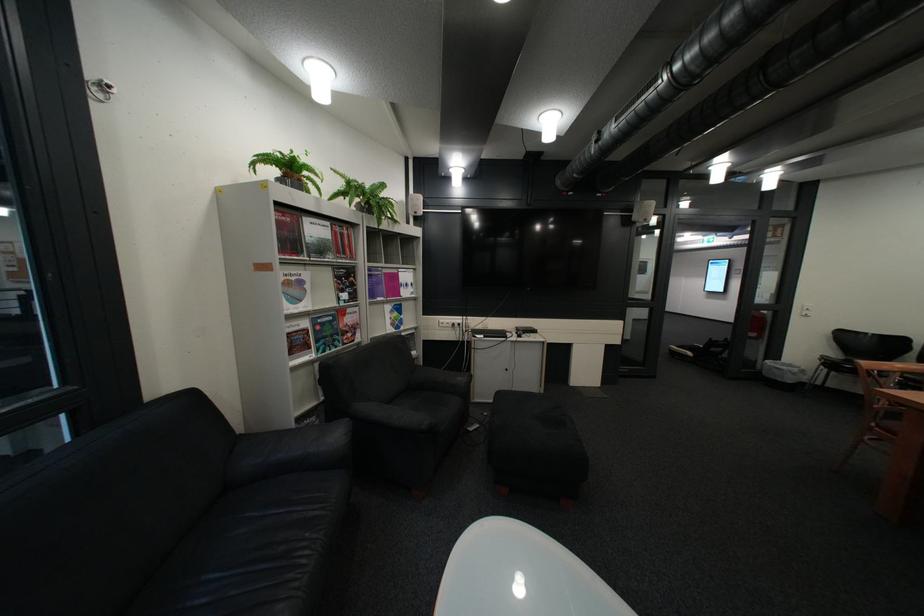
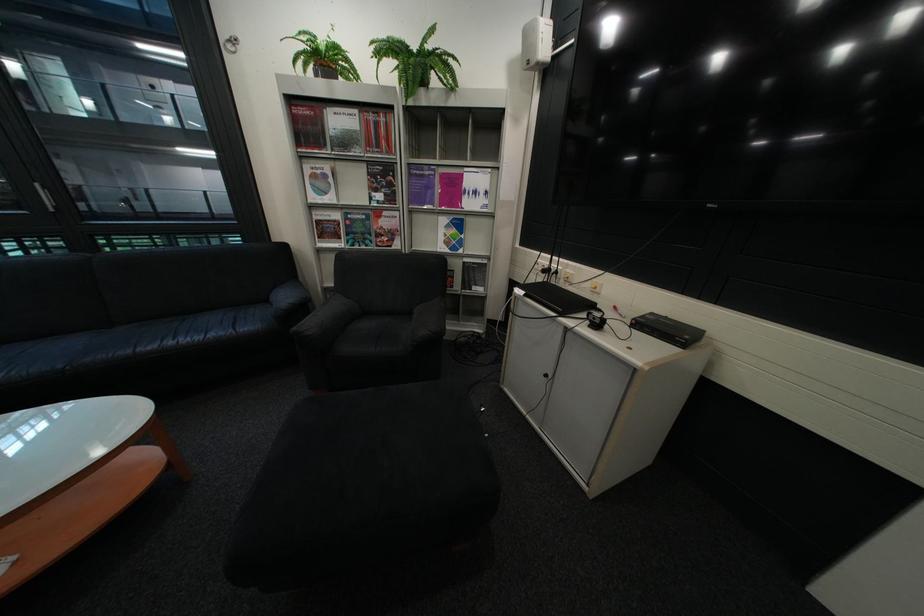
Find the pixel in the second image that matches the point at 420,293 in the first image.

(484, 204)